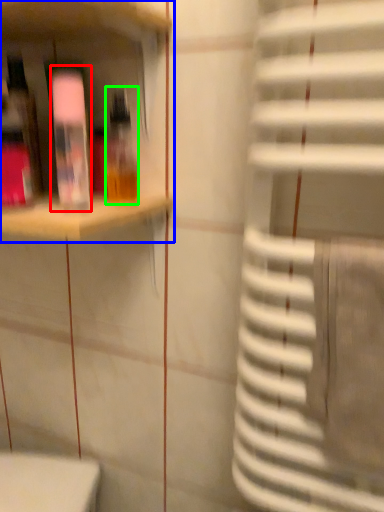
Question: Considering the real-world distances, which object is farthest from bottle (highlighted by a red box)? shelf (highlighted by a blue box) or bottle (highlighted by a green box)?

Choices:
 (A) shelf
 (B) bottle

Answer: (B)